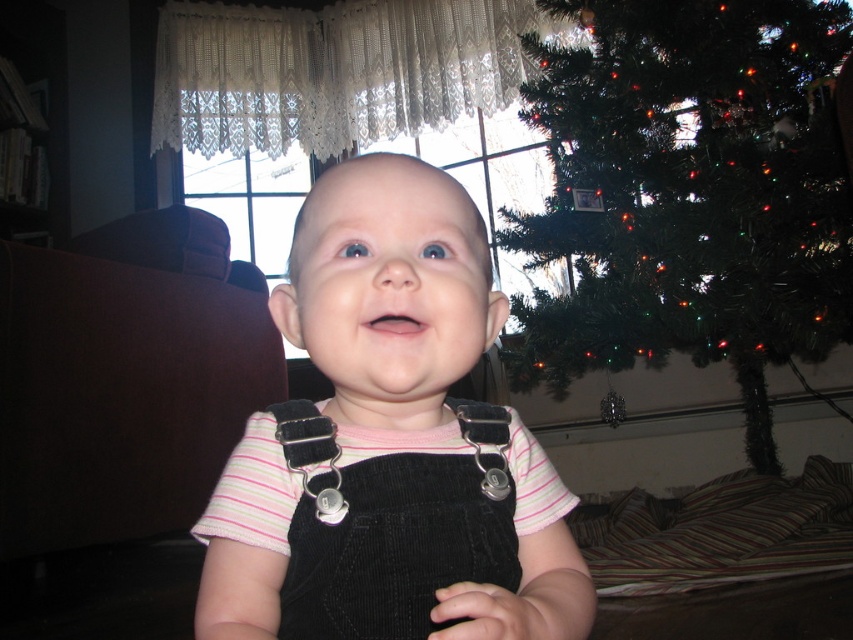
Does black corduroy overalls at center appear under black corduroy suspenders at center?

Actually, black corduroy overalls at center is above black corduroy suspenders at center.

Is point (234, 468) more distant than point (503, 451)?

No, it is not.

Locate an element on the screen. black corduroy overalls at center is located at coordinates pos(389,444).

Can you confirm if black corduroy overalls at center is thinner than green artificial christmas tree at upper right?

Correct, black corduroy overalls at center's width is less than green artificial christmas tree at upper right's.

Which is above, black corduroy overalls at center or green artificial christmas tree at upper right?

green artificial christmas tree at upper right is above.

Is point (444, 512) less distant than point (662, 220)?

Yes, point (444, 512) is in front of point (662, 220).

Find the location of a particular element. The width and height of the screenshot is (853, 640). black corduroy overalls at center is located at coordinates (389, 444).

Who is taller, green artificial christmas tree at upper right or black corduroy suspenders at center?

green artificial christmas tree at upper right

Who is positioned more to the right, green artificial christmas tree at upper right or black corduroy suspenders at center?

Positioned to the right is green artificial christmas tree at upper right.

Is point (575, 10) positioned in front of point (347, 506)?

No, it is behind (347, 506).

At what (x,y) coordinates should I click in order to perform the action: click on green artificial christmas tree at upper right. Please return your answer as a coordinate pair (x, y). This screenshot has height=640, width=853. Looking at the image, I should click on point(689,195).